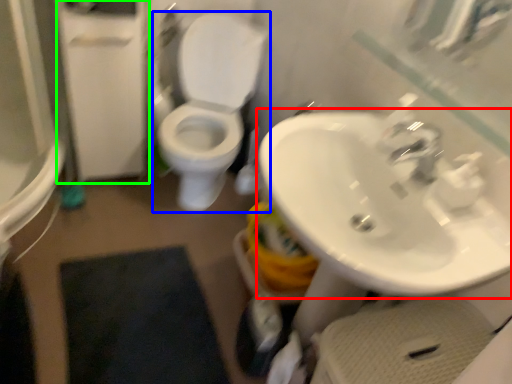
Question: Which object is the closest to the sink (highlighted by a red box)? Choose among these: toilet (highlighted by a blue box) or screen door (highlighted by a green box).

Choices:
 (A) toilet
 (B) screen door

Answer: (A)